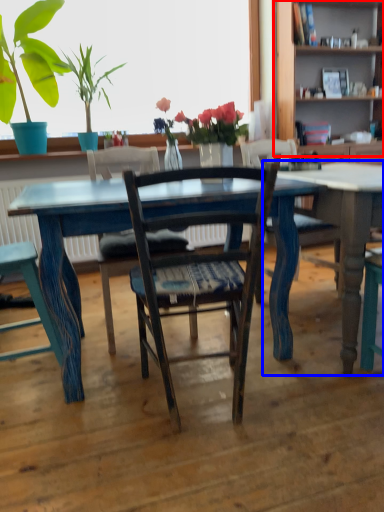
Question: Which object is closer to the camera taking this photo, bookshelf (highlighted by a red box) or table (highlighted by a blue box)?

Choices:
 (A) bookshelf
 (B) table

Answer: (B)